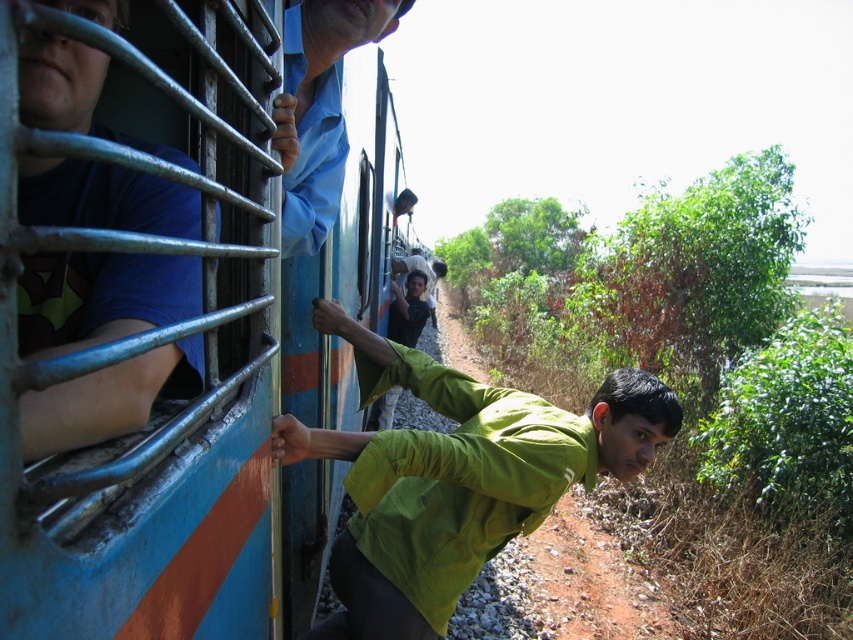
You are standing on the train platform and see the blue fabric shirt at left. Where is it positioned relative to the train window?

The blue fabric shirt at left is located at point (100, 298) relative to the train window, which means it is positioned to the left and slightly below the center of the window.

You are a photographer trying to capture a photo of the blue painted metal train at left and the blue fabric shirt at left in the same frame. Given that your camera has a maximum focus range of 3 inches, will both subjects be in focus?

The distance between the blue painted metal train at left and the blue fabric shirt at left is 2.59 inches, which is within the camera maximum focus range of 3 inches. Therefore, both subjects will be in focus.

You are a passenger on the train and want to know if the blue painted metal train at left can fit through a narrow tunnel that is only as wide as the blue fabric shirt at left. Based on their widths, can it pass through?

The blue painted metal train at left is wider than the blue fabric shirt at left, so it cannot pass through the tunnel that is only as wide as the blue fabric shirt at left.